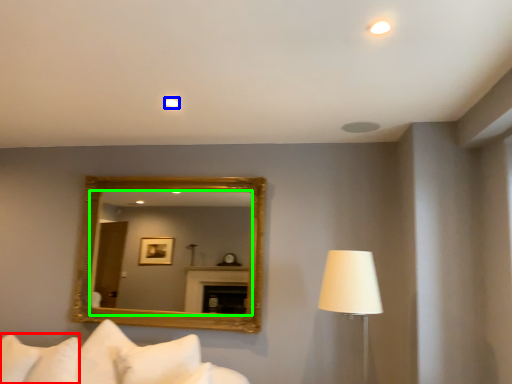
Question: Which object is positioned closest to pillow (highlighted by a red box)? Select from lighting (highlighted by a blue box) and mirror (highlighted by a green box).

Choices:
 (A) lighting
 (B) mirror

Answer: (A)